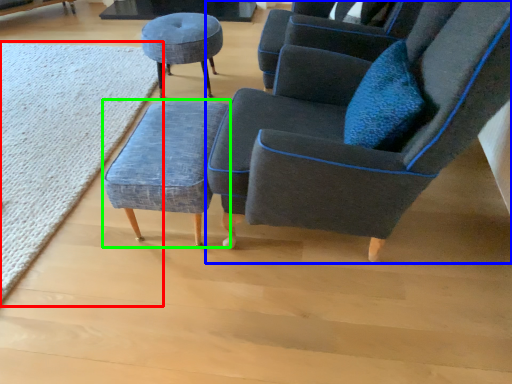
Question: Which object is positioned closest to mat (highlighted by a red box)? Select from chair (highlighted by a blue box) and stool (highlighted by a green box).

Choices:
 (A) chair
 (B) stool

Answer: (B)